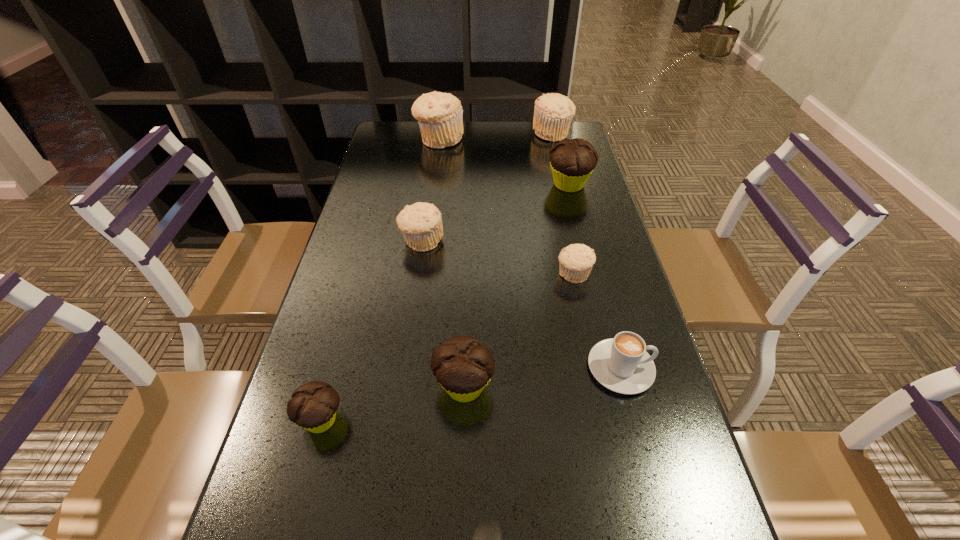
The height and width of the screenshot is (540, 960). I want to click on the leftmost chocolate muffin, so click(x=313, y=407).

You are a GUI agent. You are given a task and a screenshot of the screen. Output one action in this format:
    pyautogui.click(x=<x>, y=<y>)
    Task: Click on the leftmost object
    The width and height of the screenshot is (960, 540).
    Given the screenshot: What is the action you would take?
    click(x=313, y=407)

Identify the location of cappuccino. (621, 364).

Where is `free space located 0.130m on the right of the biggest beige muffin`? free space located 0.130m on the right of the biggest beige muffin is located at coordinates (500, 140).

Where is `free space located 0.240m on the front of the third smallest beige muffin`? The image size is (960, 540). free space located 0.240m on the front of the third smallest beige muffin is located at coordinates (564, 180).

You are a GUI agent. You are given a task and a screenshot of the screen. Output one action in this format:
    pyautogui.click(x=<x>, y=<y>)
    Task: Click on the free space located 0.120m on the back of the rightmost chocolate muffin
    
    Given the screenshot: What is the action you would take?
    pyautogui.click(x=562, y=153)

In order to click on vacant space located on the right of the third farthest beige muffin in this screenshot , I will do `click(481, 241)`.

At what (x,y) coordinates should I click in order to perform the action: click on blank space located 0.210m on the left of the second chocolate muffin from right to left. Please return your answer as a coordinate pair (x, y). The height and width of the screenshot is (540, 960). Looking at the image, I should click on (328, 386).

You are a GUI agent. You are given a task and a screenshot of the screen. Output one action in this format:
    pyautogui.click(x=<x>, y=<y>)
    Task: Click on the free space located 0.170m on the front of the fifth farthest object
    
    Given the screenshot: What is the action you would take?
    pyautogui.click(x=588, y=345)

At what (x,y) coordinates should I click in order to perform the action: click on vacant area situated 0.360m on the right of the leftmost chocolate muffin. Please return your answer as a coordinate pair (x, y). The width and height of the screenshot is (960, 540). Looking at the image, I should click on (538, 420).